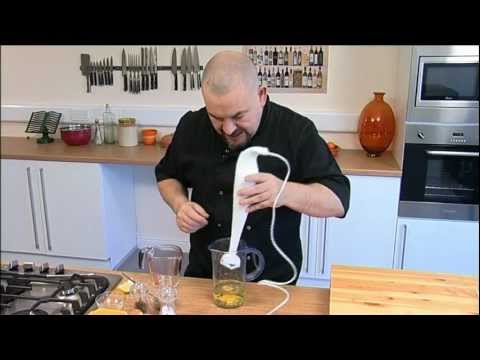
Identify the location of cord. Image resolution: width=480 pixels, height=360 pixels. (276, 249).